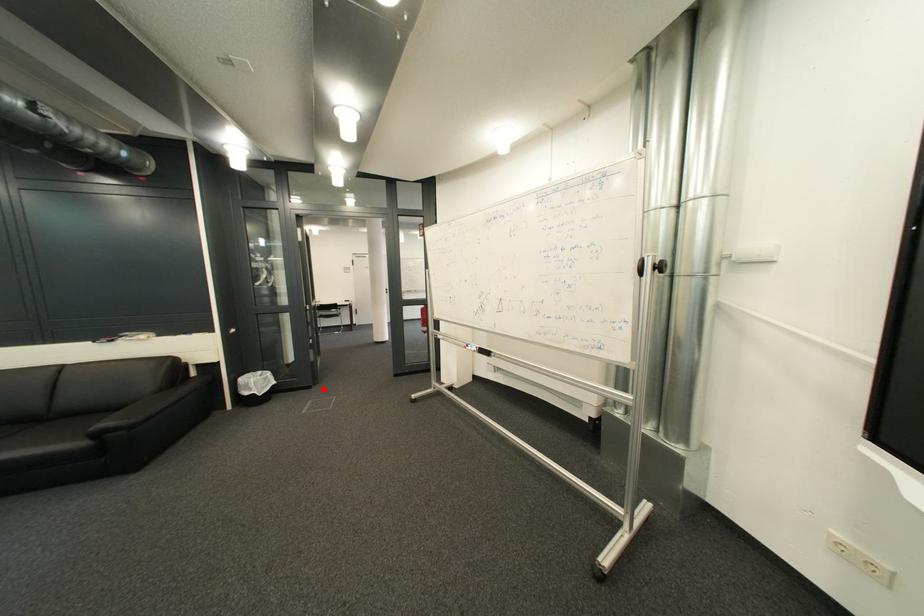
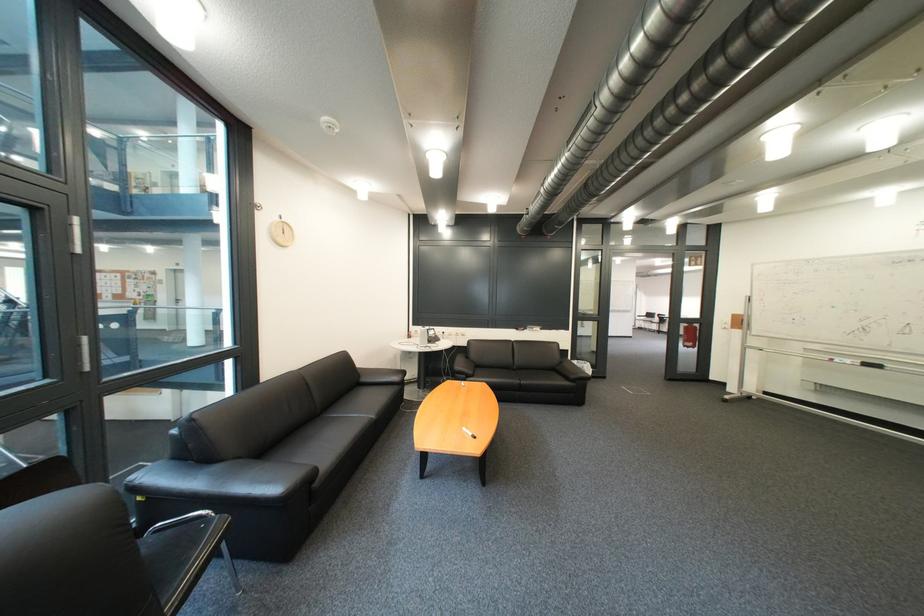
The point at the highlighted location is marked in the first image. Where is the corresponding point in the second image?

(618, 379)